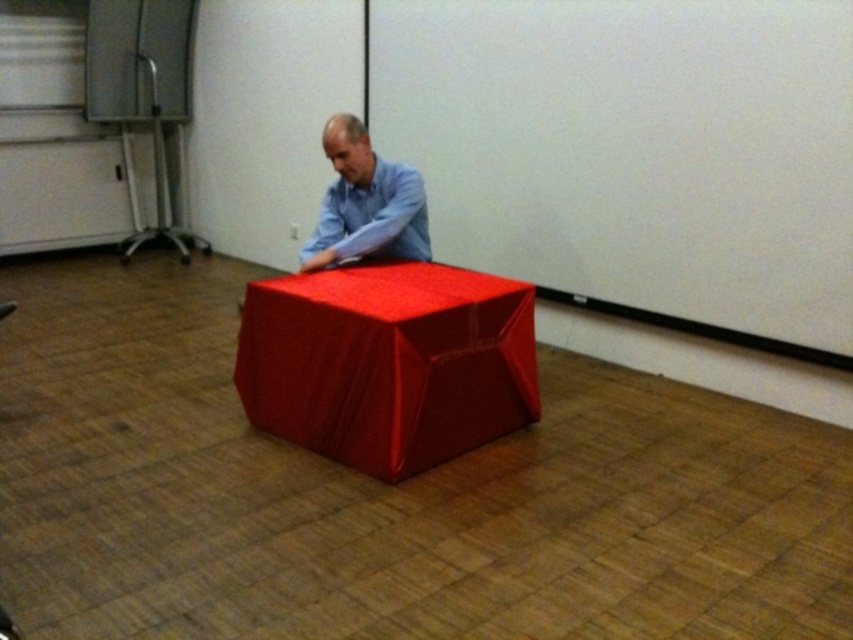
You are trying to place a rectangular box that is 1.2 meters wide on the shiny red cube at center. The matte blue shirt at center is currently on top of the cube. Can the box fit on the cube if you remove the shirt?

The shiny red cube at center has a width that surpasses the matte blue shirt at center. Since the cube is wider than the shirt, and the shirt is currently on top, removing it would allow the box to potentially fit. However, the exact width of the cube isn not specified, so we cannot confirm if the 1.2 meter box will fit without more information.

You are standing at the entrance of the room and want to place a new object exactly where the shiny red cube at center is located. What are the coordinates you should aim for?

The coordinates for the shiny red cube at center are at point (387,362).

You are standing in the room and want to pick up the matte blue shirt at center. Can you reach it without moving the shiny red cube at center?

The shiny red cube at center is closer to the viewer than the matte blue shirt at center, so you cannot reach the matte blue shirt at center without moving the shiny red cube at center first.